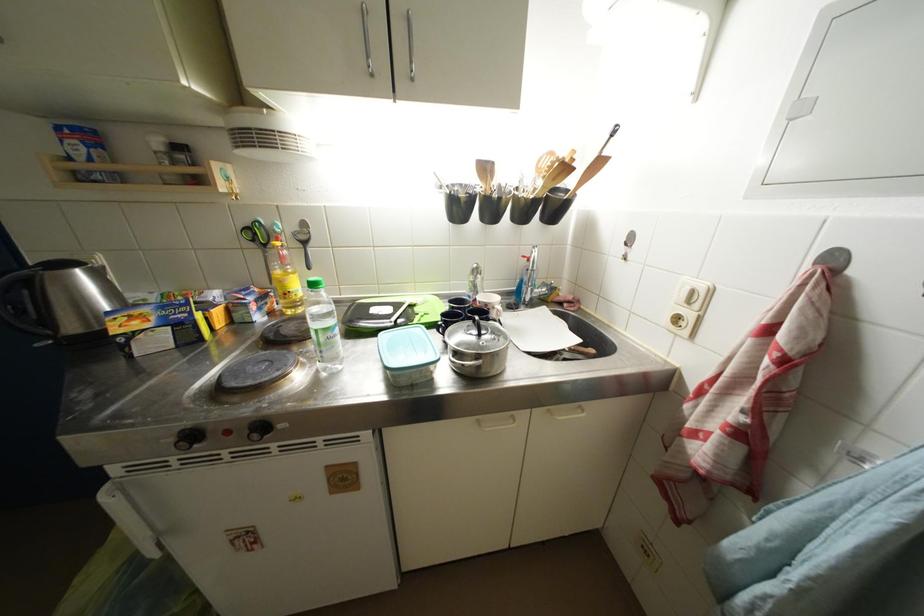
In order to click on refrigerator handle in this screenshot , I will do `click(128, 519)`.